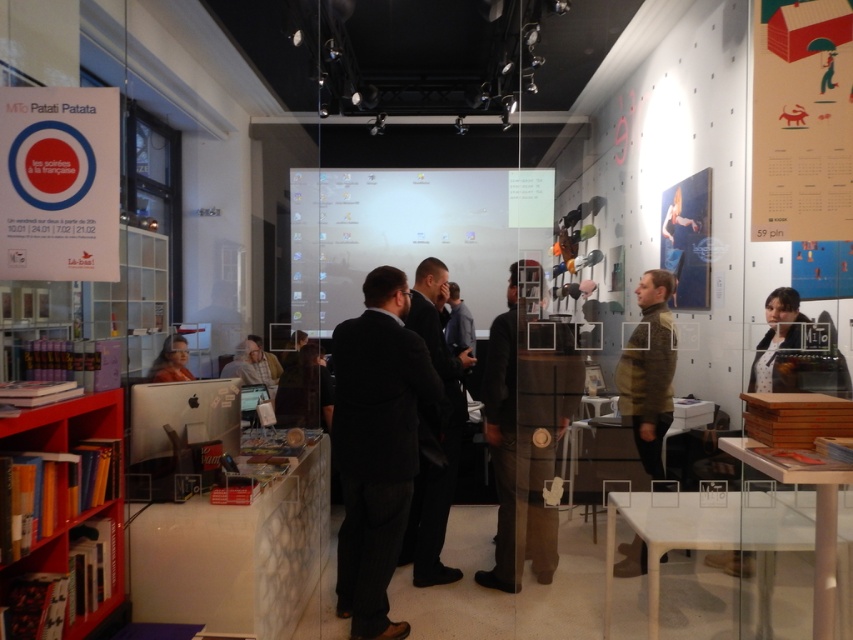
You are organizing a presentation and need to position a laptop next to the red wooden bookshelf at lower left and the matte black monitor at lower left. Since both objects are at lower left, where should you place the laptop to ensure it is between them?

The red wooden bookshelf at lower left is to the left of the matte black monitor at lower left, so placing the laptop between them would require positioning it to the right of the red wooden bookshelf at lower left and to the left of the matte black monitor at lower left.

You are an interior designer planning to place a new sofa in this room. You have a sofa that is the same size as the oil painting figure at upper right. Can the sofa fit in the space where the black woolen suit at center is currently located?

The black woolen suit at center has a larger size compared to the oil painting figure at upper right. Since the sofa is the same size as the oil painting figure at upper right, it may not fit in the space allocated for the black woolen suit at center due to the size difference.